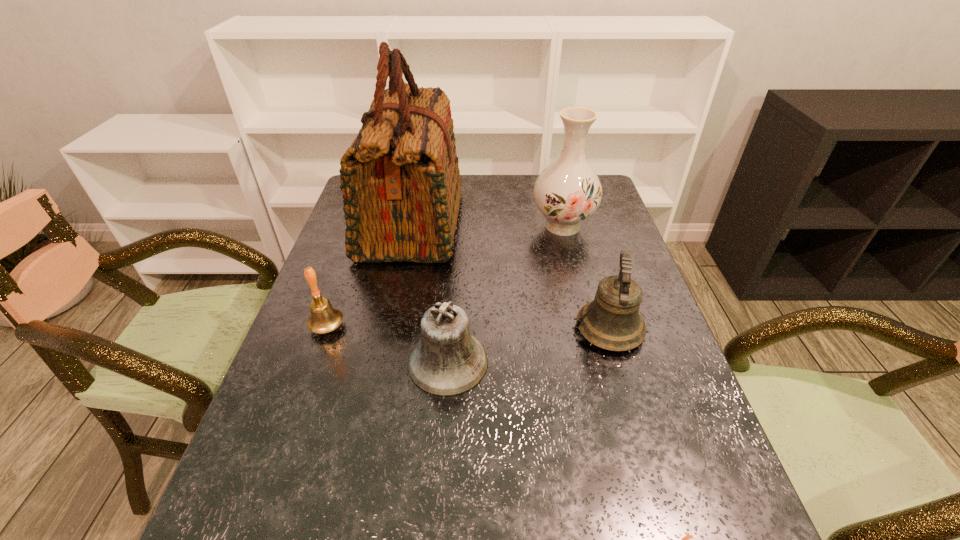
Choose which bell is the second nearest neighbor to the shopping bag. Please provide its 2D coordinates. Your answer should be formatted as a tuple, i.e. [(x, y)], where the tuple contains the x and y coordinates of a point satisfying the conditions above.

[(447, 361)]

Find the location of `blank area in the image that satisfies the following two spatial constraints: 1. on the open handle side of the shopping bag; 2. on the front side of the leftmost bell`. blank area in the image that satisfies the following two spatial constraints: 1. on the open handle side of the shopping bag; 2. on the front side of the leftmost bell is located at coordinates (391, 327).

Where is `free space in the image that satisfies the following two spatial constraints: 1. on the open handle side of the second bell from left to right; 2. on the right side of the shopping bag`? Image resolution: width=960 pixels, height=540 pixels. free space in the image that satisfies the following two spatial constraints: 1. on the open handle side of the second bell from left to right; 2. on the right side of the shopping bag is located at coordinates (383, 362).

Locate an element on the screen. vacant region that satisfies the following two spatial constraints: 1. on the open handle side of the tallest object; 2. on the left side of the second bell from right to left is located at coordinates click(383, 362).